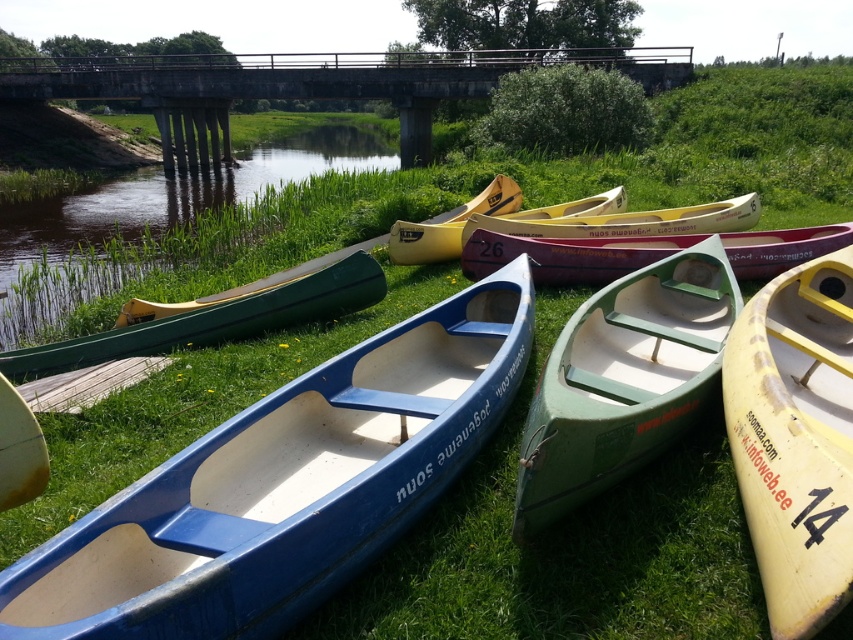
Looking at this image, you are standing at the riverside and see the concrete bridge at upper center and the matte green canoe at center. Which object is positioned more to the left?

The concrete bridge at upper center is positioned to the left of the matte green canoe at center, so the concrete bridge at upper center is more to the left.

You are standing on the riverside bank and want to board the green matte boat at center and the green matte canoe at left. Which one can you reach first without moving your position?

The green matte boat at center is closer to the viewer than the green matte canoe at left, so you can reach the green matte boat at center first without moving your position.